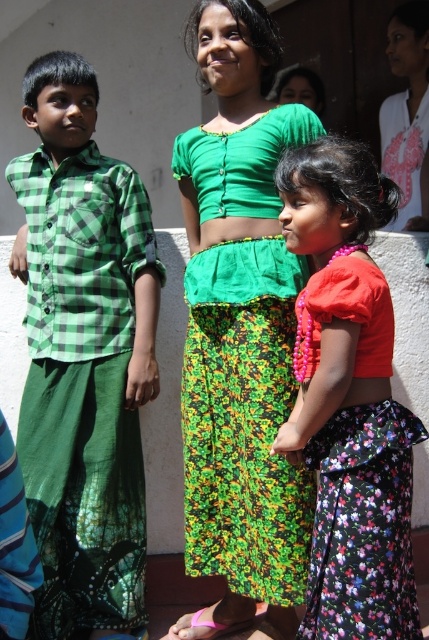
You are a photographer trying to capture a photo of the children. You notice the green checkered shirt at left and the white cotton shirt at upper right. Which child should you focus on first if you want to ensure both are in the frame without moving the camera?

You should focus on the green checkered shirt at left first because it is positioned below the white cotton shirt at upper right, so adjusting focus to the lower area will help include both in the frame.

You are a photographer trying to capture a photo of both the green checkered shirt at left and the white cotton shirt at upper right. Based on their positions, which one will appear larger in the photo?

The green checkered shirt at left will appear larger in the photo because it is closer to the viewer compared to the white cotton shirt at upper right.

You are a photographer trying to capture the best shot of the children in the scene. You notice the green woven skirt at center and the white cotton shirt at upper right. Which clothing item appears bigger in the photo?

The green woven skirt at center appears bigger in the photo because it has a larger size compared to the white cotton shirt at upper right.